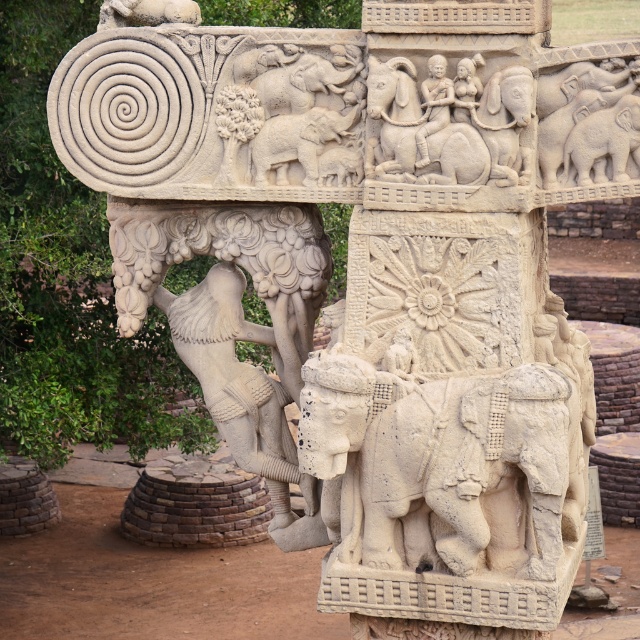
Which is more to the right, white stone elephant at center or smooth stone figure at center?

white stone elephant at center

Is white stone elephant at center below smooth stone figure at center?

Yes.

Is point (380, 560) farther from camera compared to point (250, 388)?

That is False.

Locate an element on the screen. white stone elephant at center is located at coordinates (440, 465).